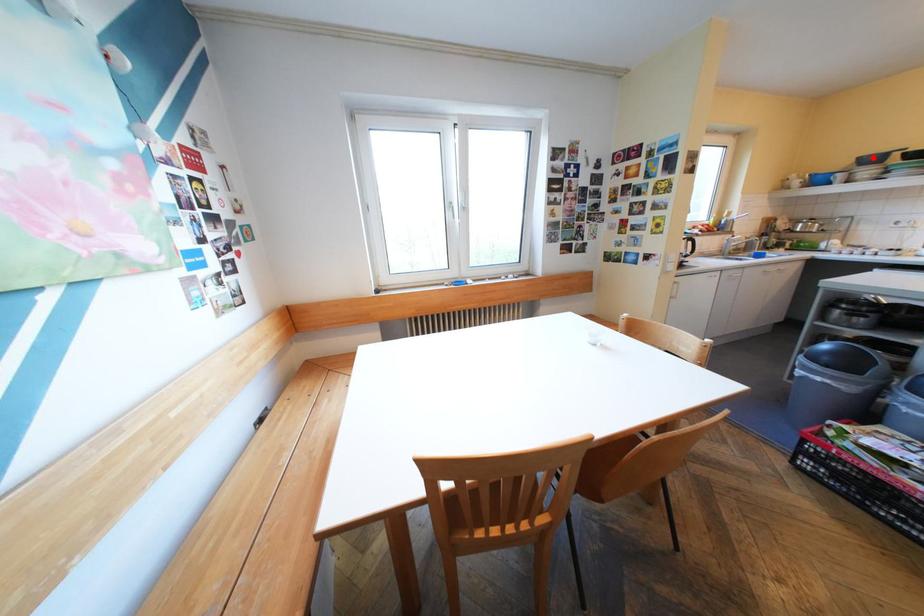
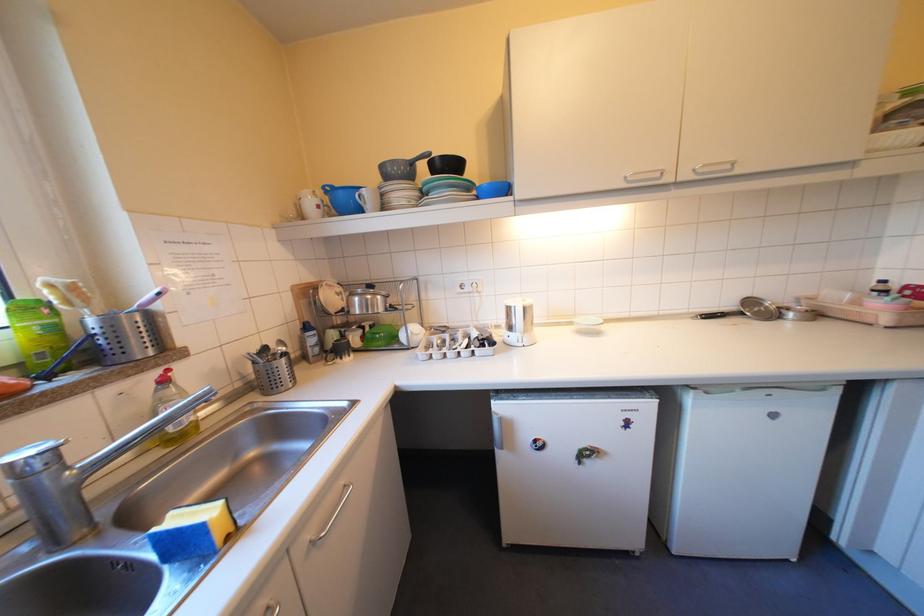
Find the pixel in the second image that matches the highlighted location in the first image.

(395, 167)